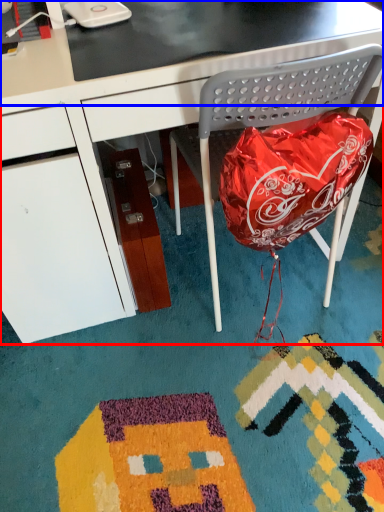
Question: Which object appears farthest to the camera in this image, desk (highlighted by a red box) or table top (highlighted by a blue box)?

Choices:
 (A) desk
 (B) table top

Answer: (B)